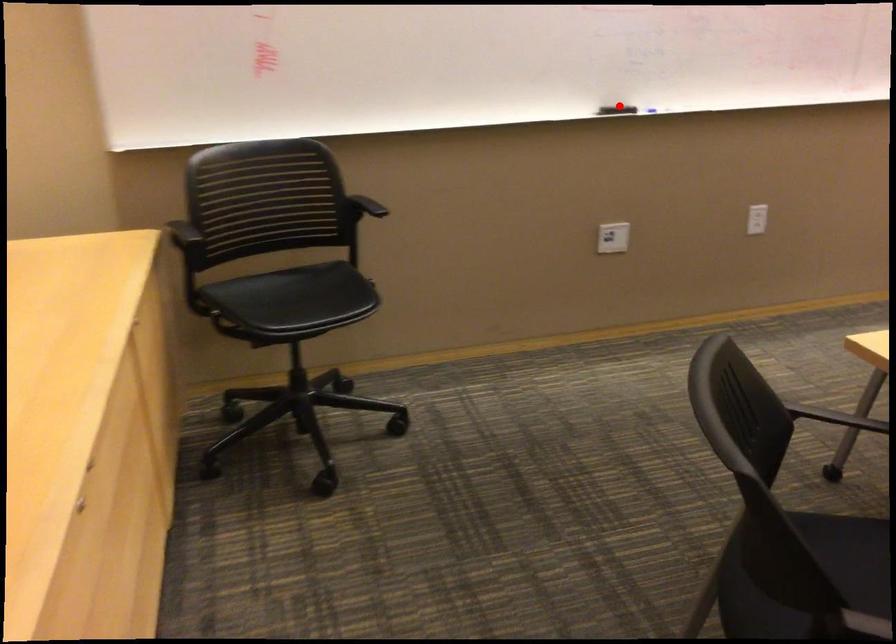
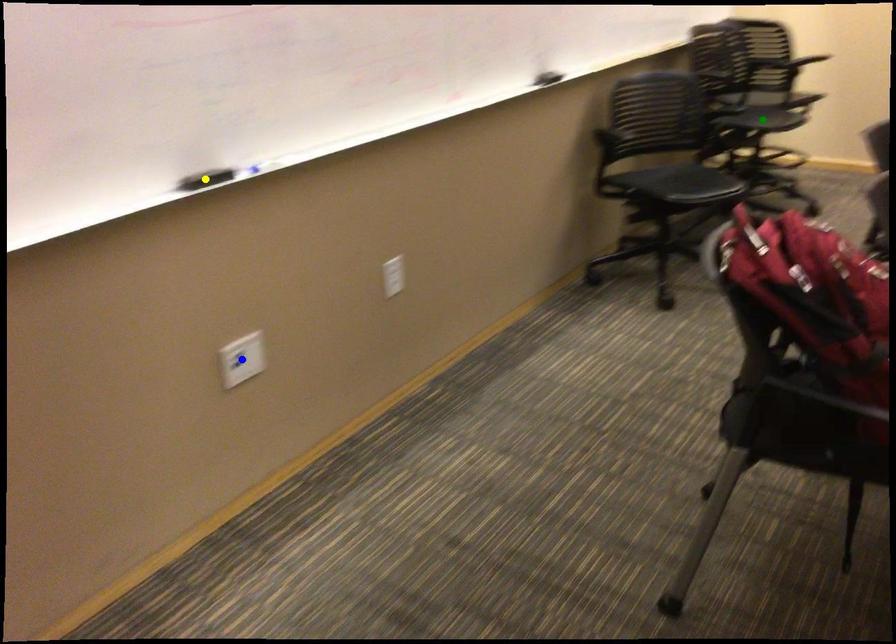
Question: I am providing you with two images of the same scene from different viewpoints. A red point is marked on the first image. You are given multiple points on the second image. Which point in image 2 represents the same 3d spot as the red point in image 1?

Choices:
 (A) blue point
 (B) yellow point
 (C) green point

Answer: (B)